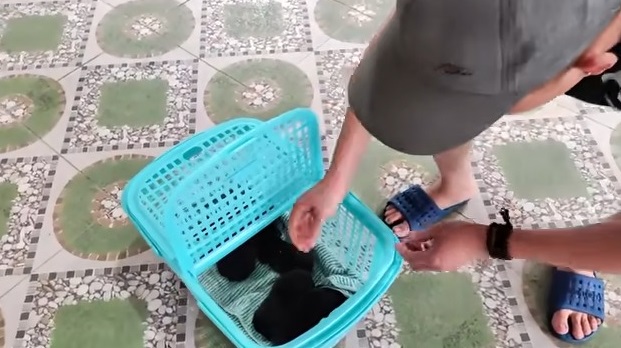
Locate an element on the screen. This screenshot has height=348, width=621. basket handles is located at coordinates (331, 333), (145, 238).